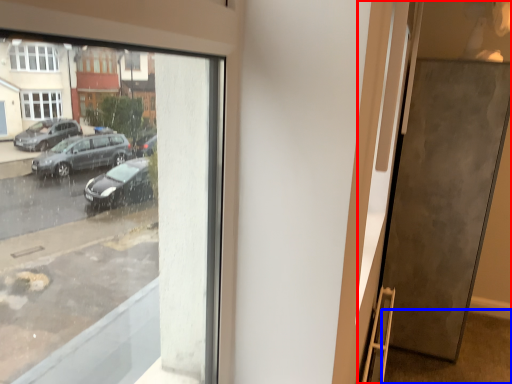
Question: Which object appears farthest to the camera in this image, door (highlighted by a red box) or pavement (highlighted by a blue box)?

Choices:
 (A) door
 (B) pavement

Answer: (A)